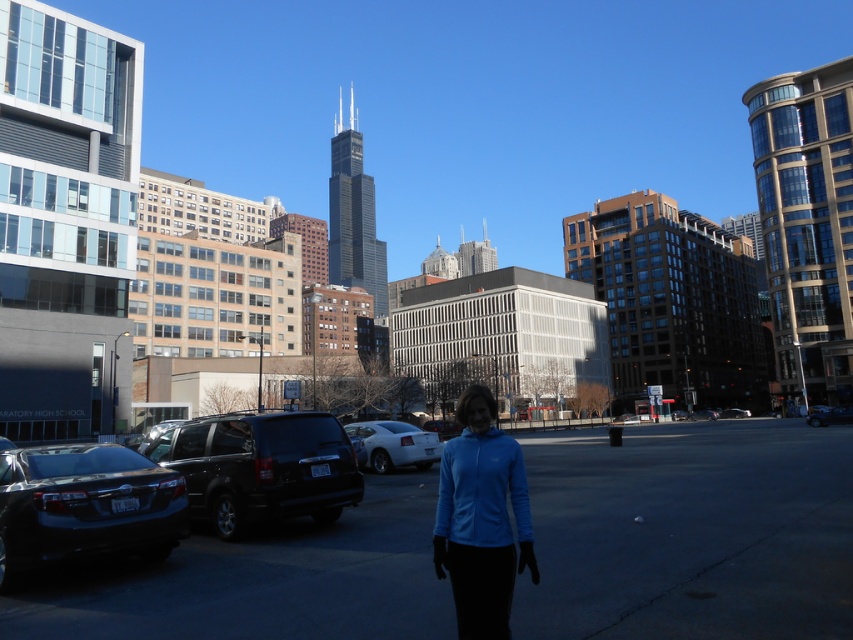
Is point (804, 490) closer to camera compared to point (399, 429)?

Yes, point (804, 490) is in front of point (399, 429).

Between point (786, 548) and point (368, 445), which one is positioned behind?

Point (368, 445)

What do you see at coordinates (689, 531) in the screenshot? I see `blue fabric parking lot at center` at bounding box center [689, 531].

Locate an element on the screen. This screenshot has width=853, height=640. blue fabric parking lot at center is located at coordinates coord(689,531).

Which is behind, point (163, 632) or point (62, 458)?

The point (62, 458) is behind.

Who is lower down, blue fabric parking lot at center or shiny black sedan at lower left?

blue fabric parking lot at center

Is point (202, 608) positioned before point (106, 502)?

Yes, it is in front of point (106, 502).

Where is `blue fabric parking lot at center`? blue fabric parking lot at center is located at coordinates (689, 531).

Can you confirm if shiny black suv at lower left is positioned to the right of metallic silver sedan at lower right?

No, shiny black suv at lower left is not to the right of metallic silver sedan at lower right.

What do you see at coordinates (260, 467) in the screenshot? I see `shiny black suv at lower left` at bounding box center [260, 467].

This screenshot has width=853, height=640. In order to click on shiny black suv at lower left in this screenshot , I will do `click(260, 467)`.